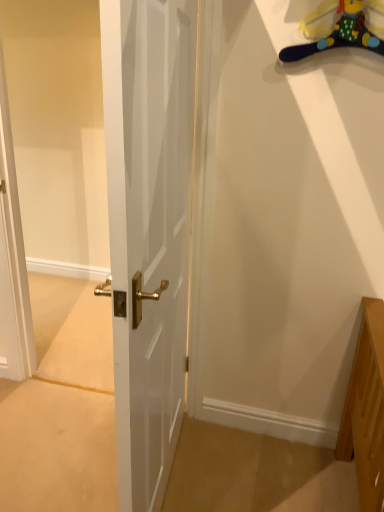
Question: From a real-world perspective, is plush yellow duck at upper right on white glossy door at center?

Choices:
 (A) no
 (B) yes

Answer: (B)

Question: Can you confirm if plush yellow duck at upper right is positioned to the left of white glossy door at center?

Choices:
 (A) no
 (B) yes

Answer: (A)

Question: Considering the relative sizes of plush yellow duck at upper right and white glossy door at center in the image provided, is plush yellow duck at upper right thinner than white glossy door at center?

Choices:
 (A) no
 (B) yes

Answer: (B)

Question: Can you confirm if plush yellow duck at upper right is taller than white glossy door at center?

Choices:
 (A) no
 (B) yes

Answer: (A)

Question: Is the surface of plush yellow duck at upper right in direct contact with white glossy door at center?

Choices:
 (A) no
 (B) yes

Answer: (A)

Question: From a real-world perspective, is plush yellow duck at upper right below white glossy door at center?

Choices:
 (A) yes
 (B) no

Answer: (B)

Question: Can you confirm if white glossy door at center is thinner than plush yellow duck at upper right?

Choices:
 (A) yes
 (B) no

Answer: (B)

Question: Is white glossy door at center facing towards plush yellow duck at upper right?

Choices:
 (A) no
 (B) yes

Answer: (A)

Question: Considering the relative sizes of white glossy door at center and plush yellow duck at upper right in the image provided, is white glossy door at center wider than plush yellow duck at upper right?

Choices:
 (A) no
 (B) yes

Answer: (B)

Question: Considering the relative sizes of white glossy door at center and plush yellow duck at upper right in the image provided, is white glossy door at center shorter than plush yellow duck at upper right?

Choices:
 (A) yes
 (B) no

Answer: (B)

Question: Does white glossy door at center have a smaller size compared to plush yellow duck at upper right?

Choices:
 (A) no
 (B) yes

Answer: (A)

Question: From the image's perspective, would you say white glossy door at center is shown under plush yellow duck at upper right?

Choices:
 (A) yes
 (B) no

Answer: (A)

Question: Does point (130, 391) appear closer or farther from the camera than point (370, 40)?

Choices:
 (A) farther
 (B) closer

Answer: (B)